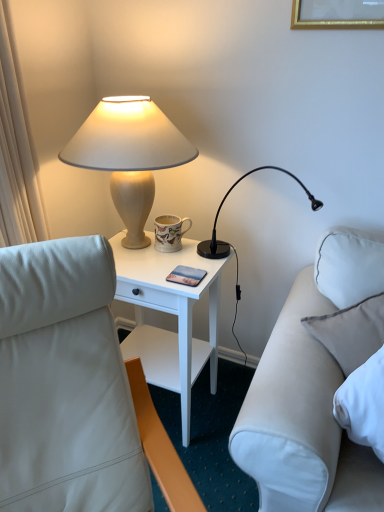
Question: Is white leather studio couch at right at the right side of matte beige lamp at upper left, the first lamp viewed from the left?

Choices:
 (A) no
 (B) yes

Answer: (B)

Question: Considering the relative positions of white leather studio couch at right and matte beige lamp at upper left, the first lamp viewed from the left, in the image provided, is white leather studio couch at right behind matte beige lamp at upper left, the first lamp viewed from the left,?

Choices:
 (A) yes
 (B) no

Answer: (B)

Question: Is matte beige lamp at upper left, the 2th lamp in the right-to-left sequence, completely or partially inside white leather studio couch at right?

Choices:
 (A) no
 (B) yes

Answer: (A)

Question: From the image's perspective, is white leather studio couch at right located beneath matte beige lamp at upper left, the 2th lamp in the right-to-left sequence?

Choices:
 (A) no
 (B) yes

Answer: (B)

Question: Is white leather studio couch at right outside of matte beige lamp at upper left, the 2th lamp in the right-to-left sequence?

Choices:
 (A) yes
 (B) no

Answer: (A)

Question: From the image's perspective, is white leather studio couch at right over matte beige lamp at upper left, the 2th lamp in the right-to-left sequence?

Choices:
 (A) no
 (B) yes

Answer: (A)

Question: Can you confirm if white leather studio couch at right is shorter than white wood nightstand at center?

Choices:
 (A) yes
 (B) no

Answer: (A)

Question: Considering the relative sizes of white leather studio couch at right and white wood nightstand at center in the image provided, is white leather studio couch at right thinner than white wood nightstand at center?

Choices:
 (A) no
 (B) yes

Answer: (B)

Question: Is the position of white leather studio couch at right less distant than that of white wood nightstand at center?

Choices:
 (A) no
 (B) yes

Answer: (B)

Question: Is white leather studio couch at right looking in the opposite direction of white wood nightstand at center?

Choices:
 (A) yes
 (B) no

Answer: (B)

Question: Is white leather studio couch at right touching white wood nightstand at center?

Choices:
 (A) yes
 (B) no

Answer: (B)

Question: Considering the relative sizes of white leather studio couch at right and white wood nightstand at center in the image provided, is white leather studio couch at right smaller than white wood nightstand at center?

Choices:
 (A) no
 (B) yes

Answer: (B)

Question: Can you confirm if matte beige lamp at upper left, the 2th lamp in the right-to-left sequence, is thinner than white wood nightstand at center?

Choices:
 (A) no
 (B) yes

Answer: (A)